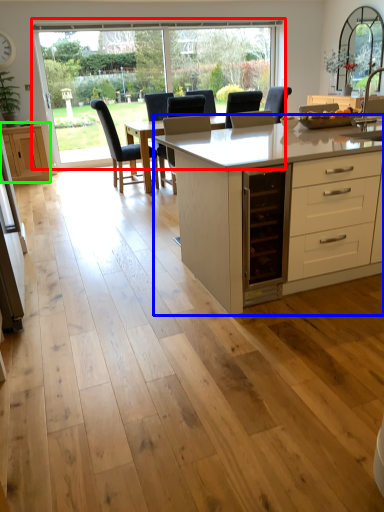
Question: Which object is positioned closest to window (highlighted by a red box)? Select from table (highlighted by a blue box) and cabinetry (highlighted by a green box).

Choices:
 (A) table
 (B) cabinetry

Answer: (B)